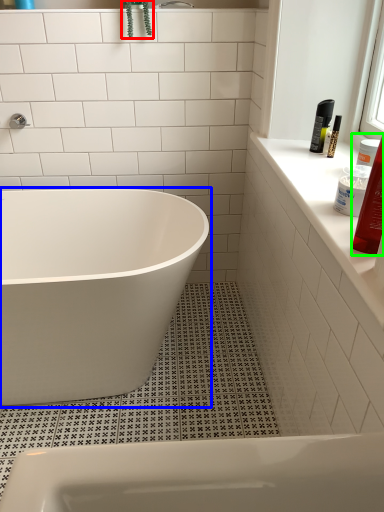
Question: Considering the real-world distances, which object is closest to plant (highlighted by a red box)? bathtub (highlighted by a blue box) or toiletry (highlighted by a green box).

Choices:
 (A) bathtub
 (B) toiletry

Answer: (A)